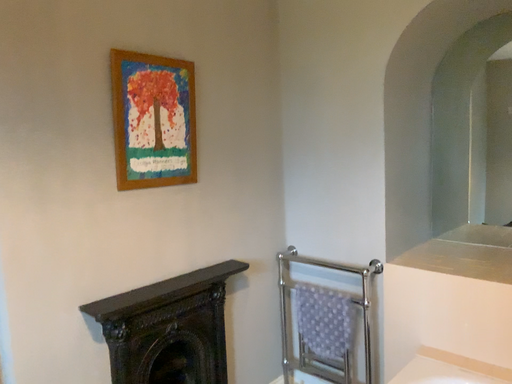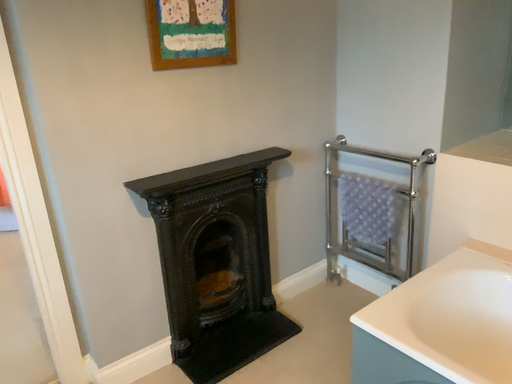
Question: How did the camera likely rotate when shooting the video?

Choices:
 (A) rotated right
 (B) rotated left

Answer: (B)